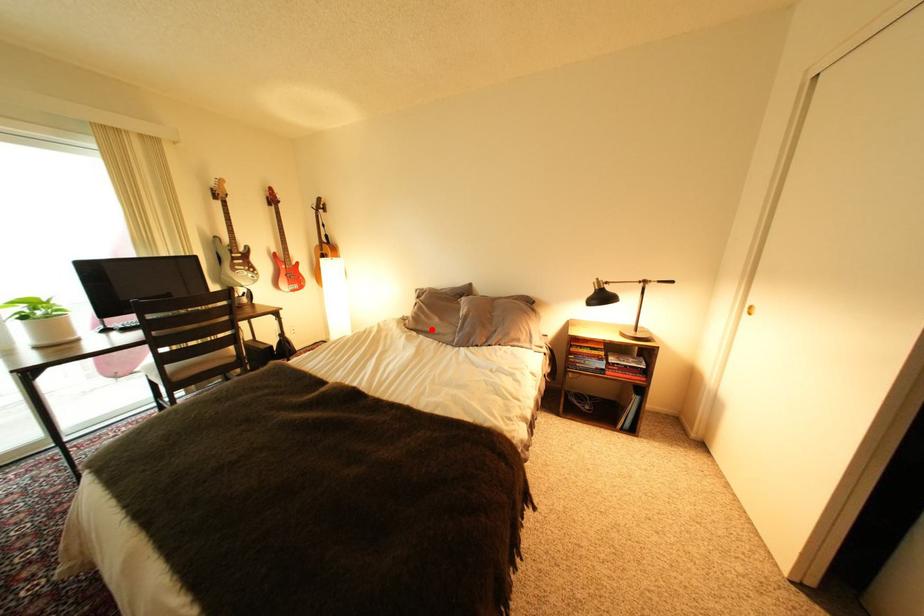
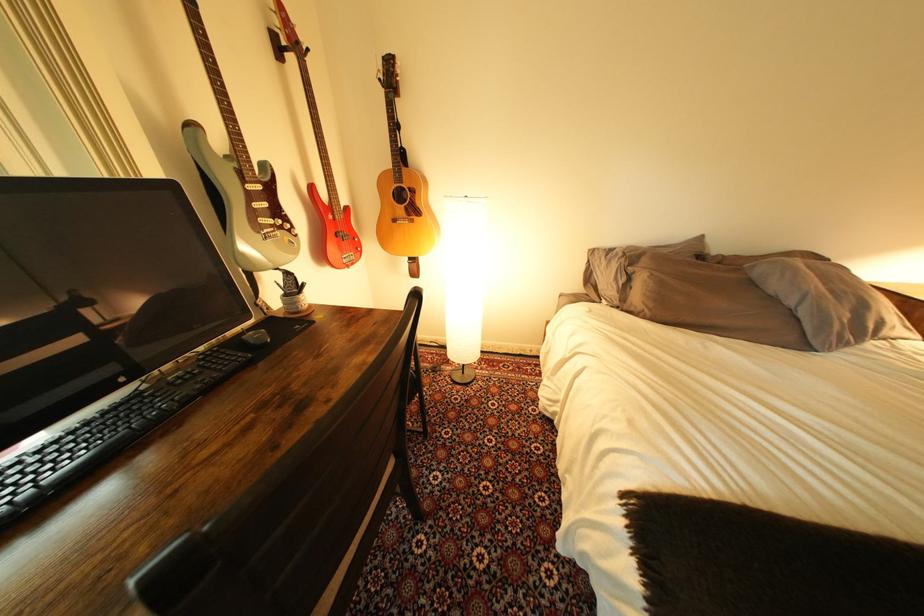
Question: I am providing you with two images of the same scene from different viewpoints. Image1 has a red point marked. In image2, the corresponding 3D location appears at what relative position? Reply with the corresponding letter.

Choices:
 (A) Closer
 (B) Farther

Answer: (A)